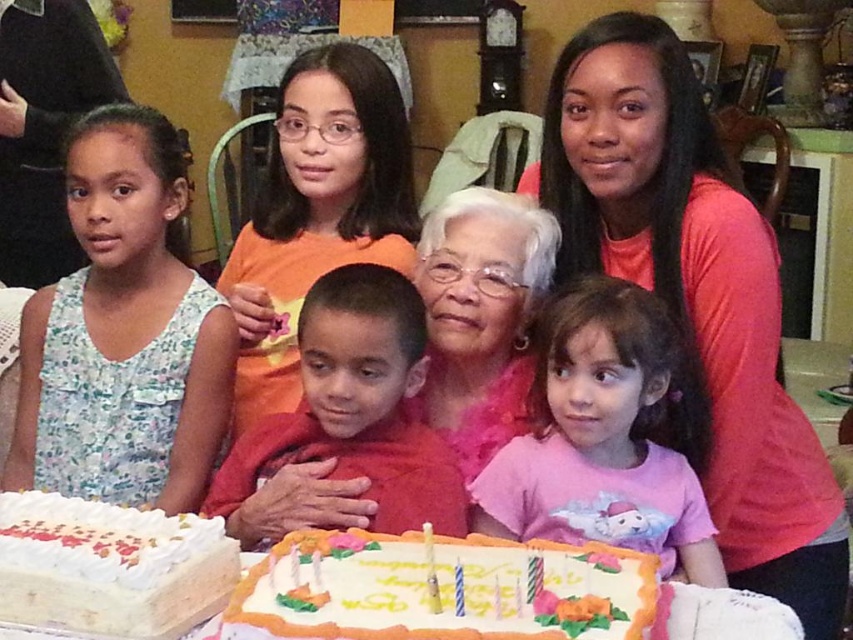
Question: Based on their relative distances, which object is farther from the smooth red shirt at center?

Choices:
 (A) white frosted cake with colorful decorations at lower center
 (B) white frosted cake at lower left
 (C) pink satin blouse at center
 (D) pink cotton shirt at lower center

Answer: (C)

Question: Which point appears closest to the camera in this image?

Choices:
 (A) (563, 316)
 (B) (268, 300)

Answer: (A)

Question: Is matte orange blouse at center wider than white frosted cake with colorful decorations at lower center?

Choices:
 (A) yes
 (B) no

Answer: (B)

Question: Which of these objects is positioned closest to the pink satin blouse at center?

Choices:
 (A) pink cotton shirt at lower center
 (B) smooth red shirt at center
 (C) matte orange blouse at center

Answer: (A)

Question: Can you confirm if pink satin blouse at center is wider than pink cotton shirt at lower center?

Choices:
 (A) no
 (B) yes

Answer: (B)

Question: Is pink satin blouse at center positioned at the back of pink cotton shirt at lower center?

Choices:
 (A) no
 (B) yes

Answer: (B)